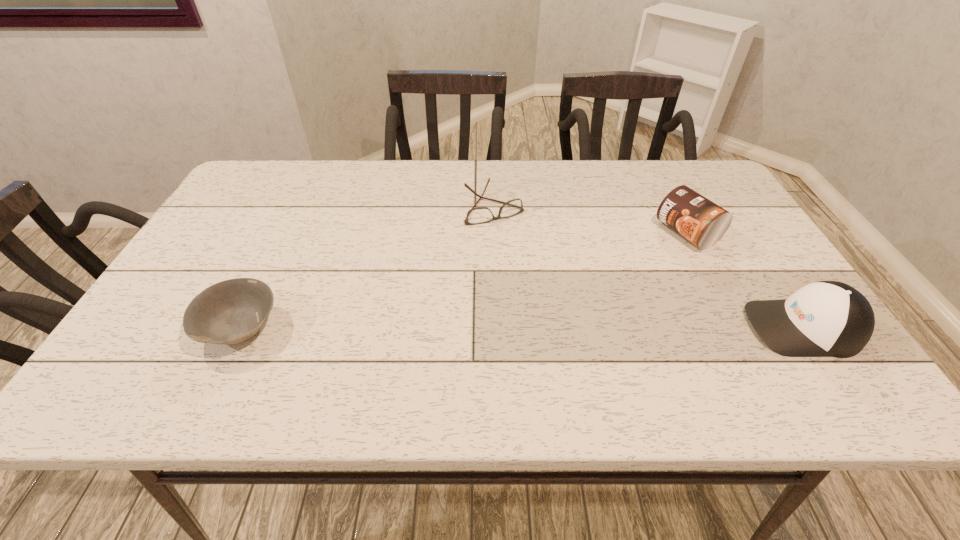
Locate an element on the screen. The image size is (960, 540). vacant area between the cap and the third object from right to left is located at coordinates (648, 267).

This screenshot has width=960, height=540. What are the coordinates of `empty space between the leftmost object and the cap` in the screenshot? It's located at (521, 327).

Where is `free space between the shortest object and the can`? free space between the shortest object and the can is located at coordinates (590, 220).

Locate an element on the screen. The height and width of the screenshot is (540, 960). vacant point located between the can and the shortest object is located at coordinates (590, 220).

Find the location of a particular element. The height and width of the screenshot is (540, 960). vacant area between the second object from left to right and the cap is located at coordinates (648, 267).

Where is `empty space between the cap and the spectacles`? The width and height of the screenshot is (960, 540). empty space between the cap and the spectacles is located at coordinates (648, 267).

This screenshot has height=540, width=960. I want to click on free space between the third tallest object and the cap, so click(521, 327).

Locate an element on the screen. The width and height of the screenshot is (960, 540). empty space between the shortest object and the third tallest object is located at coordinates (367, 267).

Find the location of `free space between the spectacles and the cap`. free space between the spectacles and the cap is located at coordinates (648, 267).

Where is `empty space that is in between the bowl and the can`? The image size is (960, 540). empty space that is in between the bowl and the can is located at coordinates (464, 280).